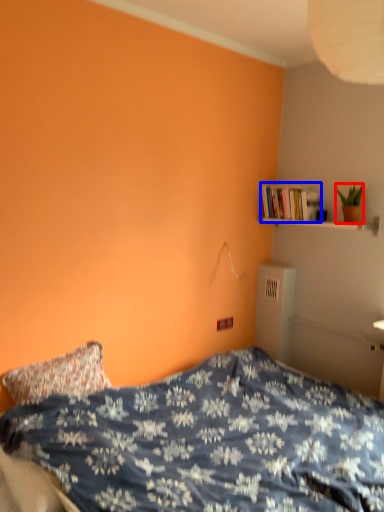
Question: Which object is further to the camera taking this photo, houseplant (highlighted by a red box) or book (highlighted by a blue box)?

Choices:
 (A) houseplant
 (B) book

Answer: (B)